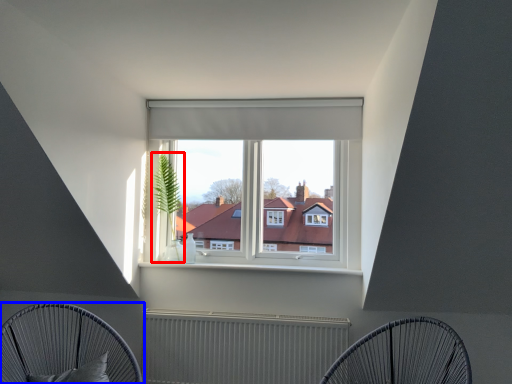
Question: Which object is further to the camera taking this photo, plant (highlighted by a red box) or furniture (highlighted by a blue box)?

Choices:
 (A) plant
 (B) furniture

Answer: (A)